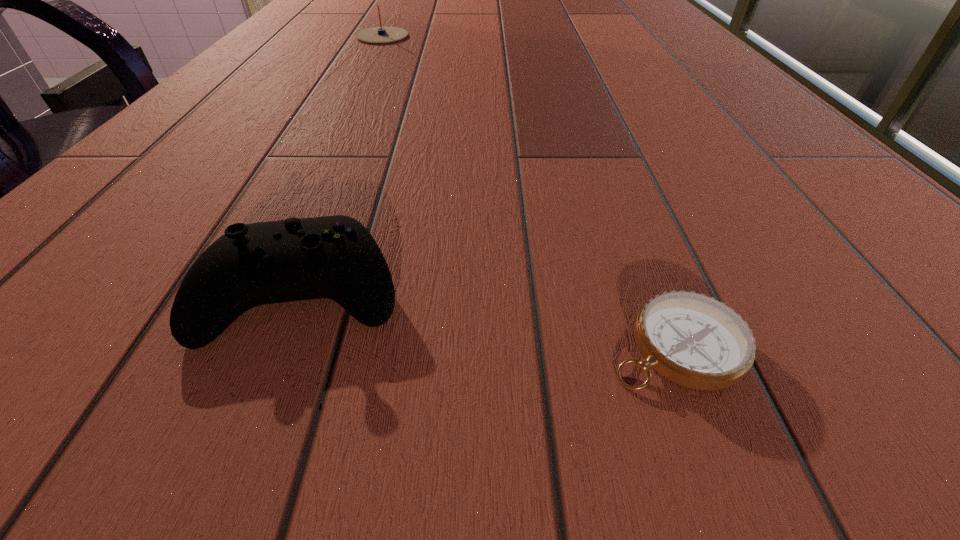
The image size is (960, 540). What are the coordinates of `the closest compass to the control` in the screenshot? It's located at (691, 339).

The height and width of the screenshot is (540, 960). In order to click on compass that can be found as the second closest to the control in this screenshot , I will do `click(380, 34)`.

Where is `vacant point that satisfies the following two spatial constraints: 1. on the front side of the control; 2. on the left side of the right compass`? The width and height of the screenshot is (960, 540). vacant point that satisfies the following two spatial constraints: 1. on the front side of the control; 2. on the left side of the right compass is located at coordinates (283, 346).